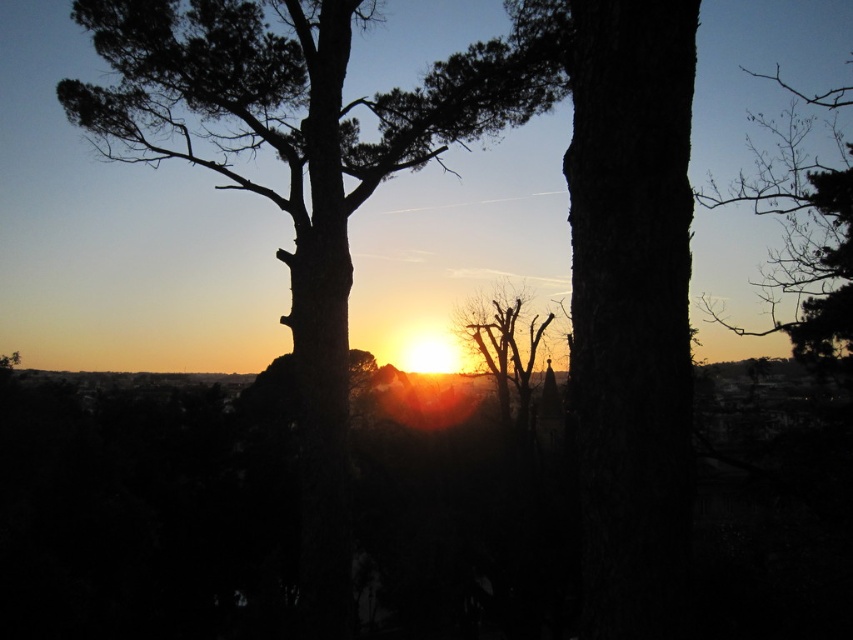
In the scene shown: You are an artist trying to paint the sunset scene. You notice two sets of bare branches against the sky. Which set of bare branches, the bare branches at upper right or the bare branches at center, is taller?

The bare branches at upper right are much taller than the bare branches at center.

You are an artist sketching the sunset scene. You notice two sets of bare branches in your drawing. Which set of bare branches, the bare branches at upper right or the bare branches at center, is closer to you?

The bare branches at upper right is closer to you because it is in front of the bare branches at center.

You are an astronomer observing the sunset. You notice a point in the sky at coordinates point [804,230]. Based on the scene, what object does this point likely correspond to?

The point [804,230] corresponds to the bare branches at upper right.